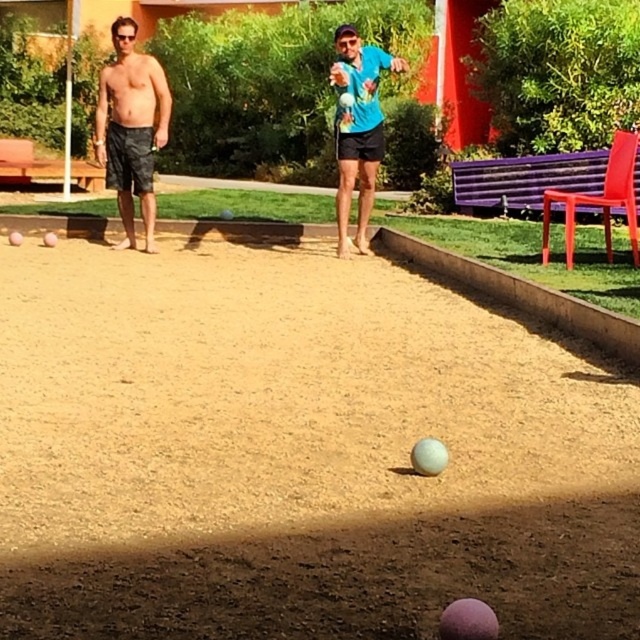
You are a photographer trying to capture a photo of the blue matte shirt at center and camouflage shorts at left for a sports magazine. From your current position, which of the two subjects is positioned higher in the frame?

The camouflage shorts at left is located above the blue matte shirt at center, so the camouflage shorts at left is positioned higher in the frame.

You are a photographer setting up a shot of the bocce ball game. You need to ensure that the brown sandy ground at center and the camouflage shorts at left are both visible in the frame. Which object should you prioritize framing first to ensure both are included?

The camouflage shorts at left should be prioritized since the brown sandy ground at center occupies less space and can fit into the frame more easily while ensuring the larger camouflage shorts at left is fully visible.